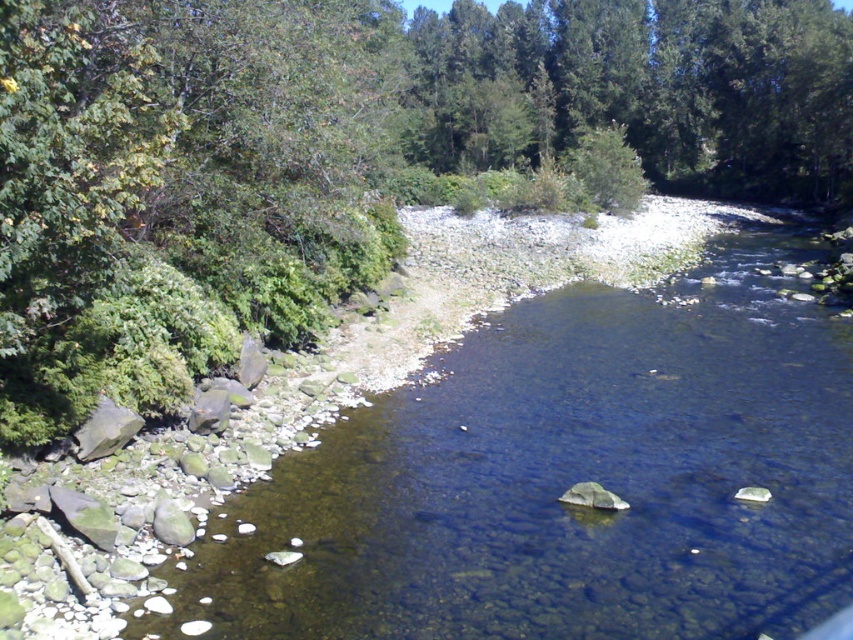
Question: Is green leafy tree at upper left in front of green leafy trees at upper center?

Choices:
 (A) no
 (B) yes

Answer: (B)

Question: Among these points, which one is nearest to the camera?

Choices:
 (A) (541, 348)
 (B) (703, 72)

Answer: (A)

Question: Which object appears closest to the camera in this image?

Choices:
 (A) green leafy tree at upper left
 (B) green leafy trees at upper center
 (C) clear water at river center

Answer: (C)

Question: Which point is farther to the camera?

Choices:
 (A) green leafy tree at upper left
 (B) clear water at river center

Answer: (A)

Question: Is green leafy tree at upper left below green leafy trees at upper center?

Choices:
 (A) yes
 (B) no

Answer: (A)

Question: In this image, where is green leafy tree at upper left located relative to green leafy trees at upper center?

Choices:
 (A) above
 (B) below

Answer: (B)